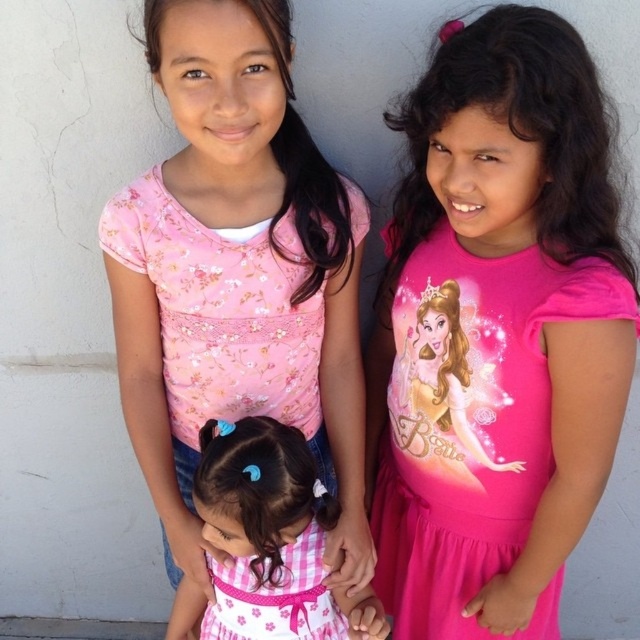
Locate an element on the screen. pink checkered dress at center is located at coordinates (268, 541).

Is pink checkered dress at center thinner than pink cotton dress at center?

No, pink checkered dress at center is not thinner than pink cotton dress at center.

Between point (266, 513) and point (308, 609), which one is positioned in front?

Point (266, 513) is more forward.

Image resolution: width=640 pixels, height=640 pixels. What are the coordinates of `pink checkered dress at center` in the screenshot? It's located at (268, 541).

Between point (154, 17) and point (308, 532), which one is positioned behind?

Point (308, 532)

Between point (124, 288) and point (228, 588), which one is positioned in front?

Positioned in front is point (124, 288).

The image size is (640, 640). Find the location of `pink floral shirt at center`. pink floral shirt at center is located at coordinates (237, 275).

Between pink satin dress at center and pink checkered dress at center, which one is positioned lower?

pink checkered dress at center

Can you confirm if pink satin dress at center is positioned to the right of pink checkered dress at center?

Yes, pink satin dress at center is to the right of pink checkered dress at center.

Where is `pink satin dress at center`? This screenshot has width=640, height=640. pink satin dress at center is located at coordinates (472, 426).